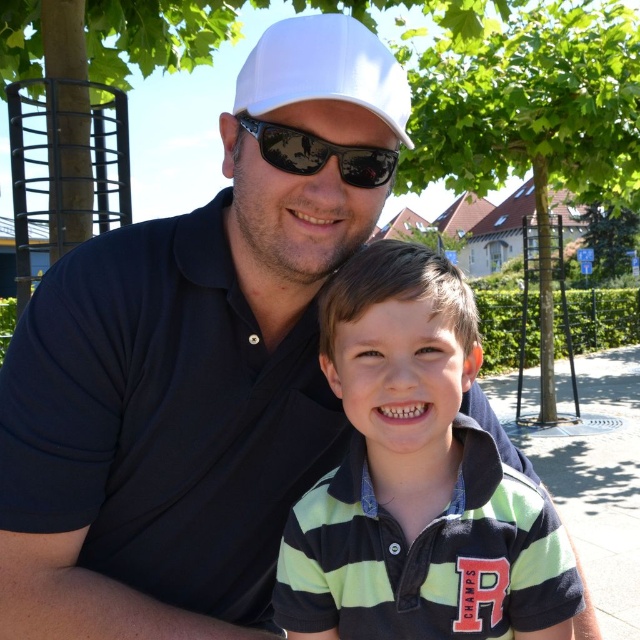
In order to click on matte black polo shirt at center in this screenshot , I will do `click(195, 364)`.

Is matte black polo shirt at center below black reflective sunglasses at center?

Correct, matte black polo shirt at center is located below black reflective sunglasses at center.

Locate an element on the screen. matte black polo shirt at center is located at coordinates (195, 364).

Is point (465, 564) farther from viewer compared to point (298, 84)?

Yes, point (465, 564) is behind point (298, 84).

Which is above, green striped polo shirt at center or white matte cap at upper center?

white matte cap at upper center

Is point (388, 280) farther from camera compared to point (376, 44)?

No, (388, 280) is in front of (376, 44).

Find the location of `green striped polo shirt at center`. green striped polo shirt at center is located at coordinates (416, 480).

Which is above, matte black polo shirt at center or green striped polo shirt at center?

matte black polo shirt at center

Can you confirm if matte black polo shirt at center is taller than green striped polo shirt at center?

Indeed, matte black polo shirt at center has a greater height compared to green striped polo shirt at center.

Is point (326, 433) farther from camera compared to point (346, 499)?

Yes, point (326, 433) is behind point (346, 499).

Where is `matte black polo shirt at center`? This screenshot has height=640, width=640. matte black polo shirt at center is located at coordinates (195, 364).